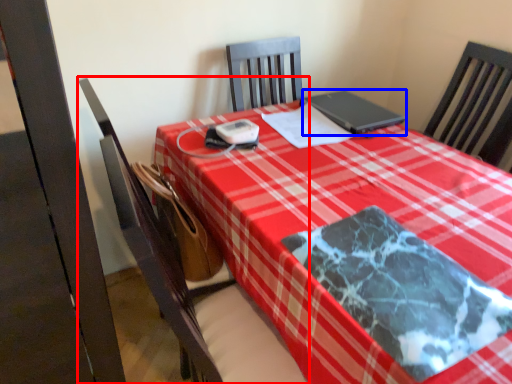
Question: Which object is closer to the camera taking this photo, chair (highlighted by a red box) or laptop (highlighted by a blue box)?

Choices:
 (A) chair
 (B) laptop

Answer: (A)